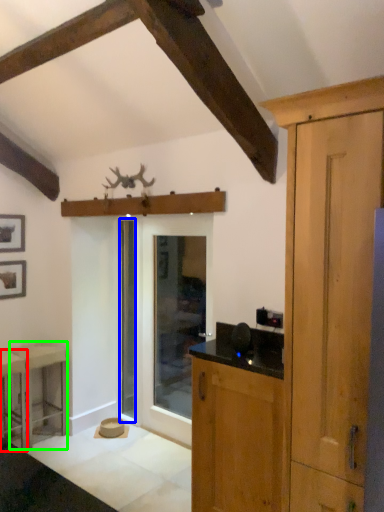
Question: Which object is positioned farthest from stool (highlighted by a red box)? Select from screen door (highlighted by a blue box) and stool (highlighted by a green box).

Choices:
 (A) screen door
 (B) stool

Answer: (A)